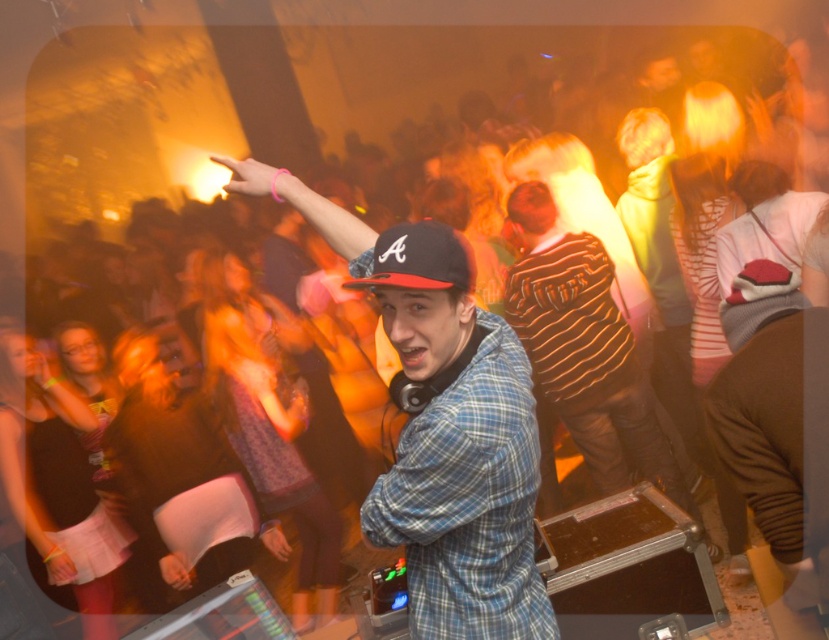
Who is more forward, (x=480, y=310) or (x=448, y=236)?

Point (x=448, y=236) is more forward.

Does blue plaid shirt at center lie behind black matte baseball cap at center?

Yes, blue plaid shirt at center is further from the viewer.

Does point (418, 625) lie in front of point (400, 282)?

No, (418, 625) is behind (400, 282).

You are a GUI agent. You are given a task and a screenshot of the screen. Output one action in this format:
    pyautogui.click(x=<x>, y=<y>)
    Task: Click on the blue plaid shirt at center
    The height and width of the screenshot is (640, 829).
    Given the screenshot: What is the action you would take?
    pyautogui.click(x=445, y=436)